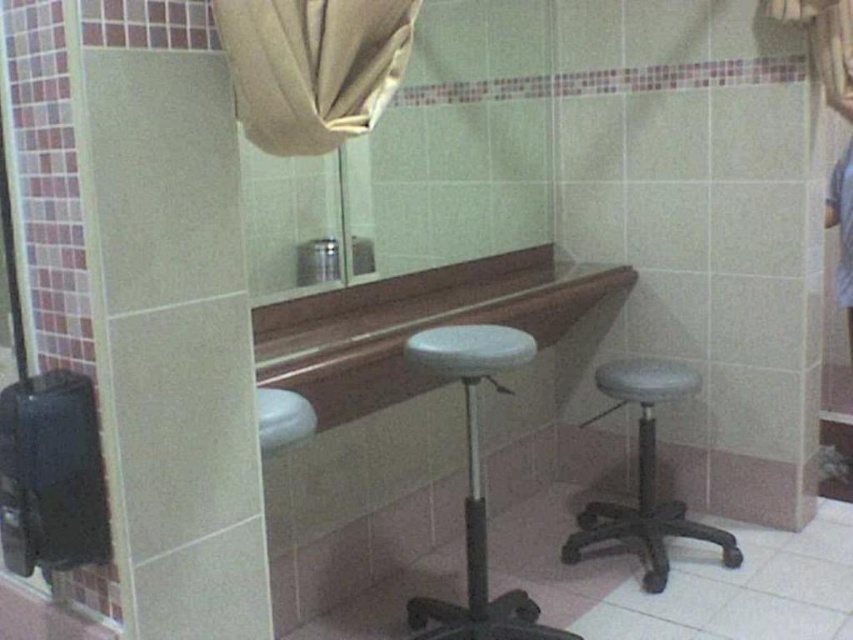
You are a person who is 160 cm tall and want to sit comfortably on one of the bar stools in the bathroom. Which stool, the white matte bar stool at center or the gray matte bar stool at center, would be more suitable for your height?

The white matte bar stool at center is much taller than the gray matte bar stool at center. Since you are 160 cm tall, the gray matte bar stool at center would be more suitable as it is shorter and provides a better seating height for comfort.

You are designing a layout for a bathroom and need to place a new decorative shelf between the matte glass mirror at center and the white glossy sink at center. Given that the shelf requires 1 meter of space, can the shelf fit between them based on their widths?

The matte glass mirror at center is wider than the white glossy sink at center. However, the question is about the space between them, not their widths. Since the description only provides information about their widths relative to each other and not the distance between them, it is impossible to determine if the 1 meter shelf can fit. More information about the spacing between the two objects is needed.